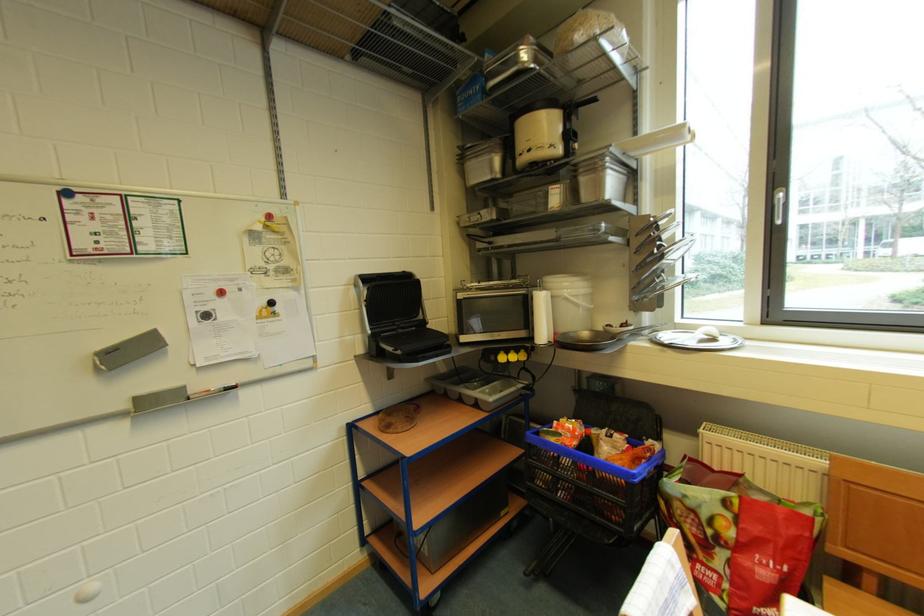
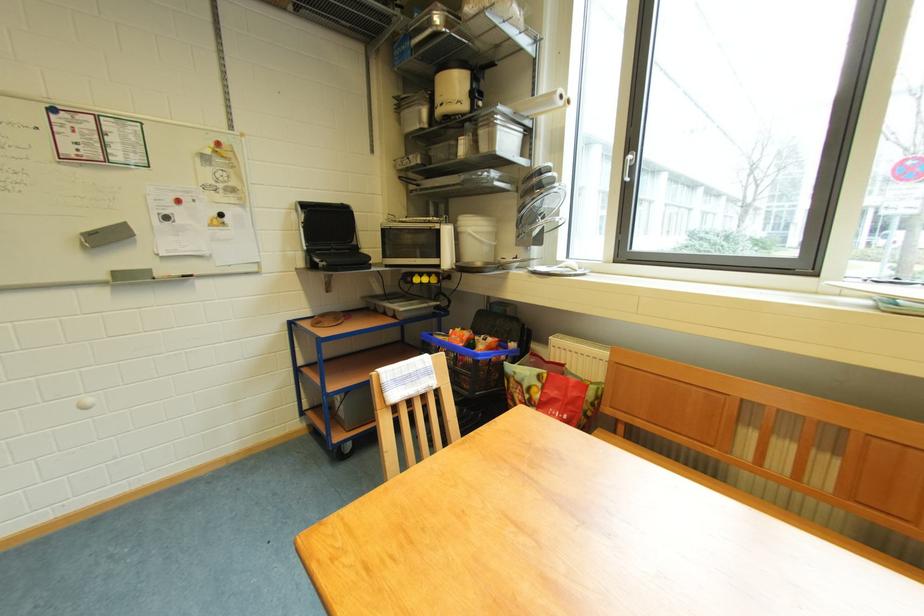
Find the pixel in the second image that matches point (785, 204) in the first image.

(634, 161)